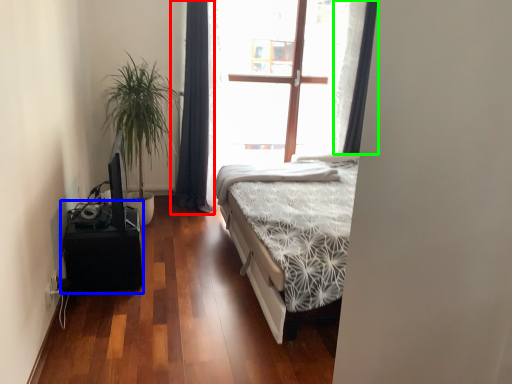
Question: Which object is positioned closest to curtain (highlighted by a red box)? Select from table (highlighted by a blue box) and curtain (highlighted by a green box).

Choices:
 (A) table
 (B) curtain

Answer: (B)